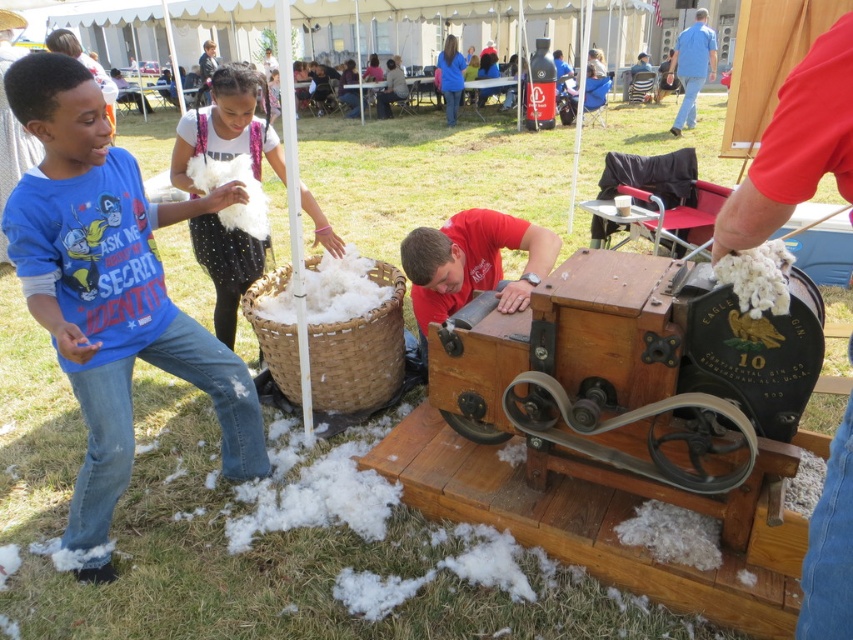
Question: Can you confirm if blue cotton shirt at left is thinner than white fluffy cotton at center?

Choices:
 (A) no
 (B) yes

Answer: (B)

Question: Can you confirm if blue cotton shirt at left is bigger than white fluffy cotton at center?

Choices:
 (A) yes
 (B) no

Answer: (B)

Question: Which point is closer to the camera taking this photo?

Choices:
 (A) (51, 232)
 (B) (251, 112)

Answer: (A)

Question: Which point is farther to the camera?

Choices:
 (A) blue cotton shirt at left
 (B) blue cotton shirt at upper right
 (C) white fluffy cotton at center

Answer: (B)

Question: Which of the following is the farthest from the observer?

Choices:
 (A) (21, 60)
 (B) (683, 100)

Answer: (B)

Question: Does white fluffy cotton at center have a lesser width compared to blue cotton shirt at upper right?

Choices:
 (A) yes
 (B) no

Answer: (A)